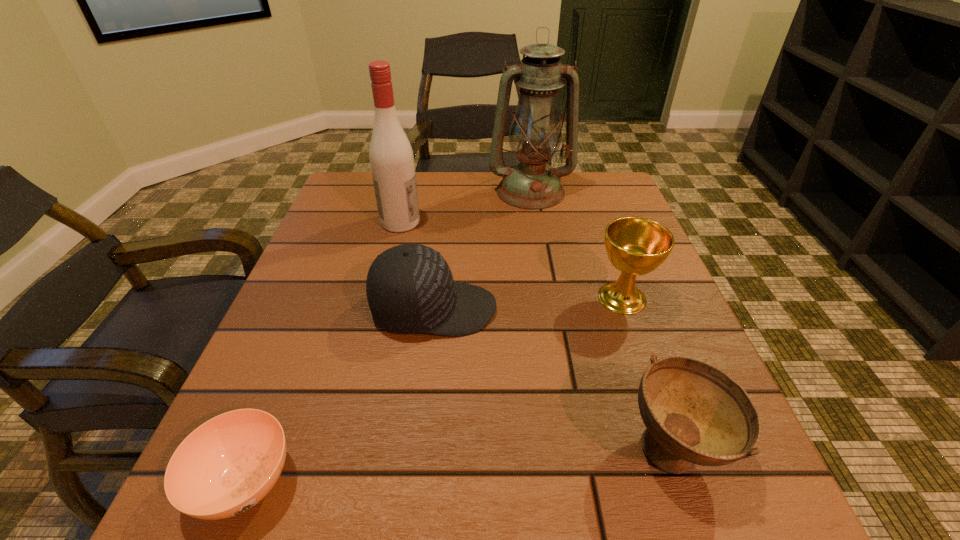
Locate an element on the screen. The height and width of the screenshot is (540, 960). object at the far left corner is located at coordinates (391, 157).

Locate an element on the screen. This screenshot has width=960, height=540. object that is at the near left corner is located at coordinates (227, 465).

Image resolution: width=960 pixels, height=540 pixels. Identify the location of object located in the far right corner section of the desktop. (535, 134).

You are a GUI agent. You are given a task and a screenshot of the screen. Output one action in this format:
    pyautogui.click(x=<x>, y=<y>)
    Task: Click on the object present at the near right corner
    Image resolution: width=960 pixels, height=540 pixels.
    Given the screenshot: What is the action you would take?
    pyautogui.click(x=694, y=413)

Where is `vacant region at the far edge of the desktop`? The height and width of the screenshot is (540, 960). vacant region at the far edge of the desktop is located at coordinates (473, 201).

The width and height of the screenshot is (960, 540). In the image, there is a desktop. Find the location of `vacant region at the near edge`. vacant region at the near edge is located at coordinates (326, 527).

In the image, there is a desktop. Where is `vacant space at the left edge`? Image resolution: width=960 pixels, height=540 pixels. vacant space at the left edge is located at coordinates (346, 303).

Find the location of a particular element. This screenshot has width=960, height=540. free space at the right edge is located at coordinates (643, 276).

At what (x,y) coordinates should I click in order to perform the action: click on free space at the far left corner of the desktop. Please return your answer as a coordinate pair (x, y). Looking at the image, I should click on point(350,199).

Where is `free space at the far right corner`? The width and height of the screenshot is (960, 540). free space at the far right corner is located at coordinates (588, 183).